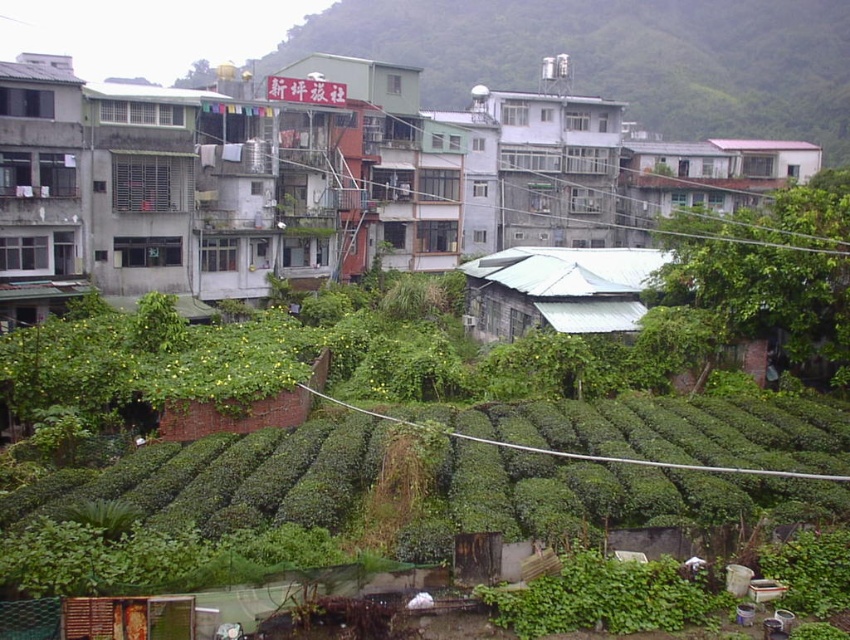
You are a delivery drone trying to navigate between the green matte building at upper center and the gray concrete building at center. According to the scene, which building should you approach first from the left side?

The green matte building at upper center is to the left of the gray concrete building at center, so you should approach the green matte building at upper center first from the left side.

You are a drone operator trying to map the coordinates of structures in this residential area. You need to locate the green matte building at upper center. What are its coordinates?

The green matte building at upper center is located at coordinates point (618,56).